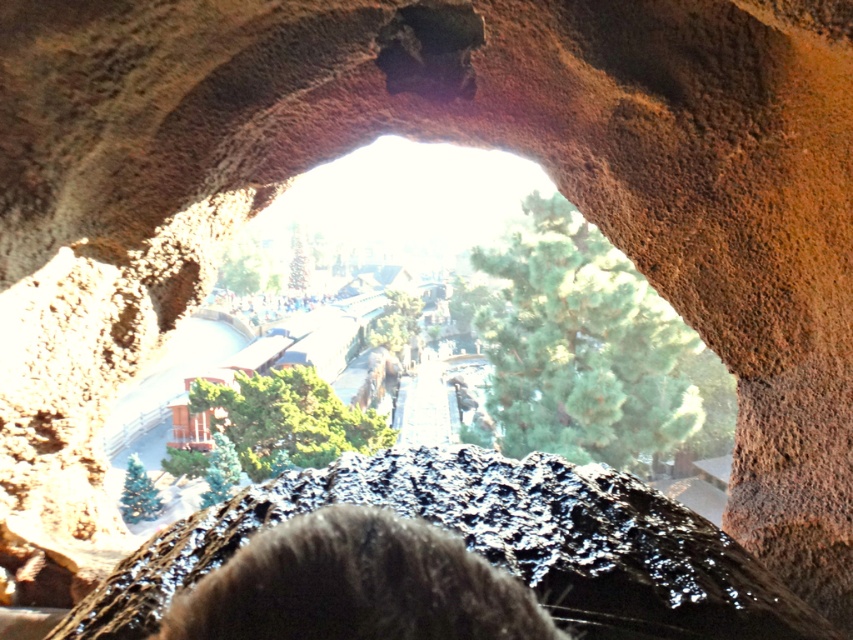
Does black matte coal at center appear on the right side of matte black crowd at center?

Yes, black matte coal at center is to the right of matte black crowd at center.

Does black matte coal at center appear on the left side of matte black crowd at center?

In fact, black matte coal at center is to the right of matte black crowd at center.

Locate an element on the screen. This screenshot has height=640, width=853. black matte coal at center is located at coordinates (492, 545).

Identify the location of black matte coal at center. (492, 545).

Does brown rough rock at center have a greater height compared to matte black crowd at center?

Correct, brown rough rock at center is much taller as matte black crowd at center.

Is brown rough rock at center positioned in front of matte black crowd at center?

That is False.

In order to click on brown rough rock at center in this screenshot , I will do `click(387, 212)`.

Where is `brown rough rock at center`? brown rough rock at center is located at coordinates (387, 212).

Where is `black matte coal at center`? This screenshot has width=853, height=640. black matte coal at center is located at coordinates (492, 545).

Can you confirm if black matte coal at center is positioned above brown rough rock at center?

Actually, black matte coal at center is below brown rough rock at center.

Who is more forward, (361, 468) or (412, 186)?

Point (361, 468)

Locate an element on the screen. The image size is (853, 640). black matte coal at center is located at coordinates (492, 545).